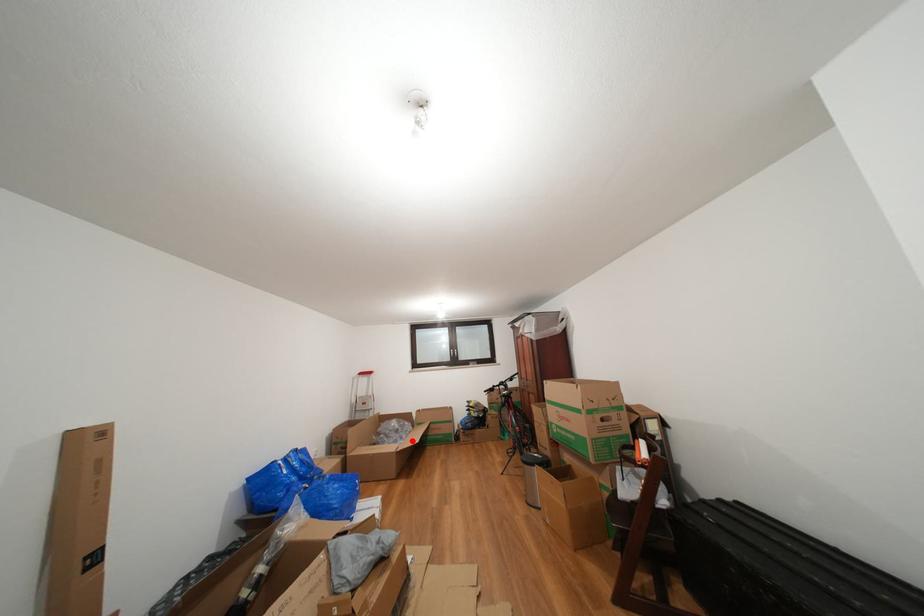
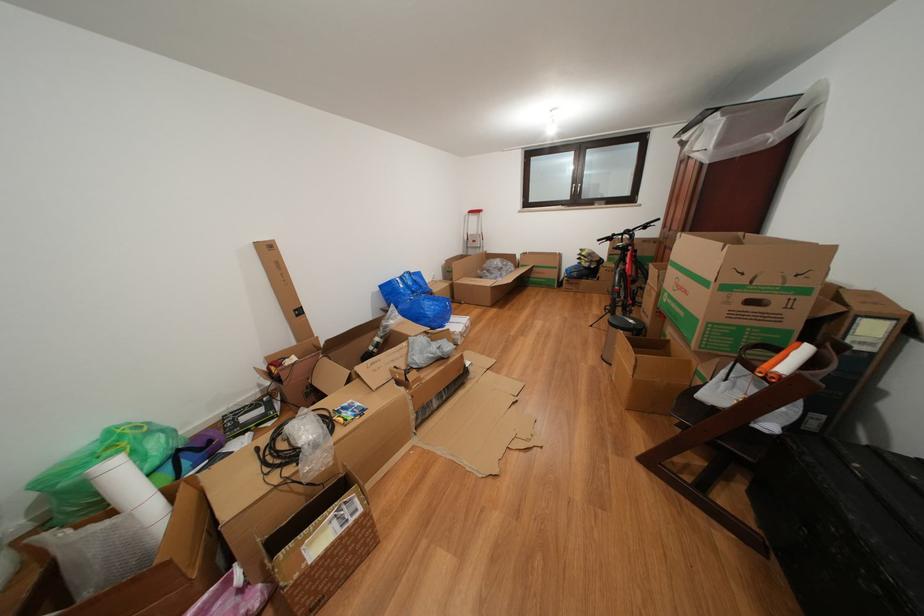
Question: I am providing you with two images of the same scene from different viewpoints. In image1, a red point is highlighted. Considering the same 3D point in image2, which of the following is correct?

Choices:
 (A) It is closer
 (B) It is farther

Answer: (A)